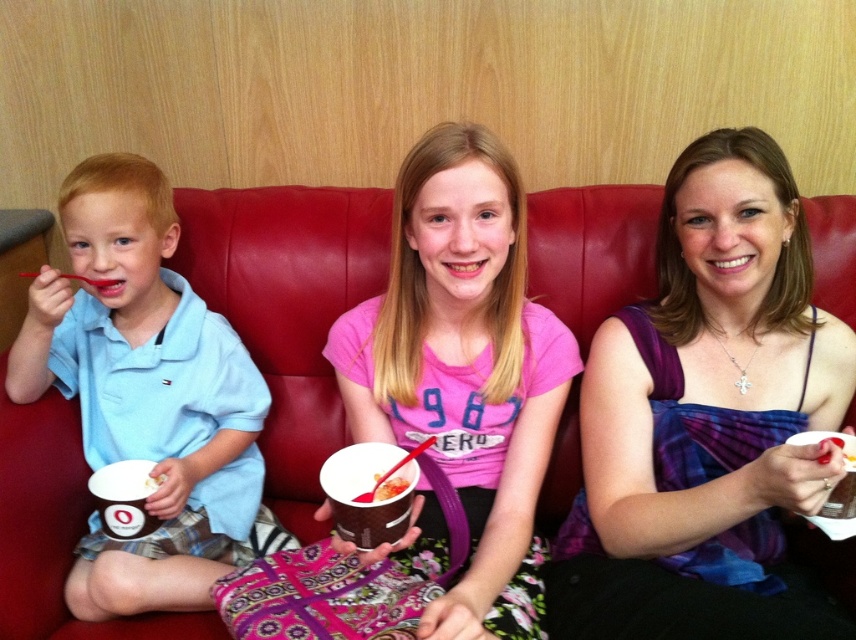
You are standing in the room and want to hand a toy to the child wearing the pink cotton shirt at center. Based on their position, where should you approach from?

The pink cotton shirt at center is located at point (461, 381), so you should approach from the center area of the room to reach the child wearing the pink cotton shirt at center.

You are standing in the room and see the three children on the red leather couch. Where is the pink cotton shirt at center located in terms of coordinates?

The pink cotton shirt at center is located at coordinates point (461, 381).